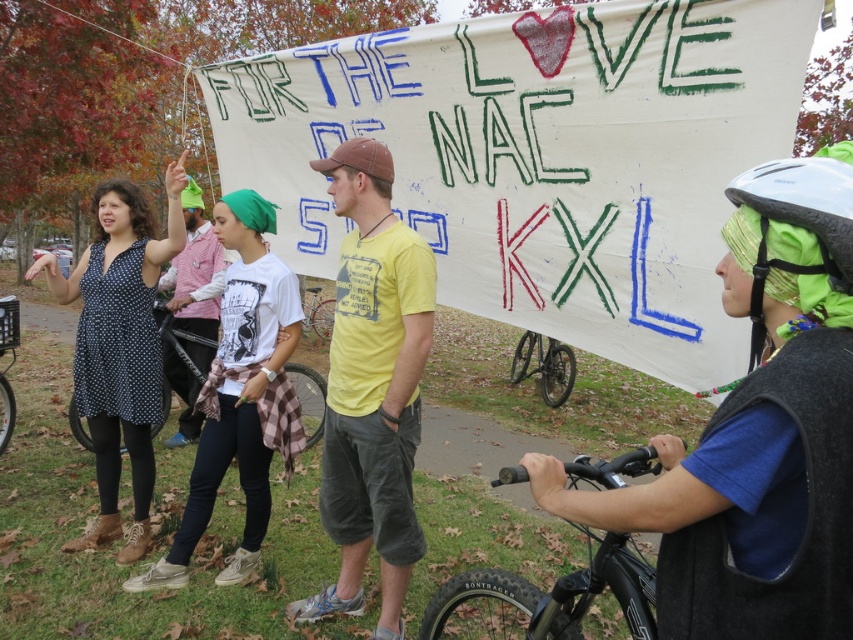
You are a pedestrian trying to cross the path where the black matte bicycle at lower center and the metallic silver bicycle at center are positioned. Which bicycle should you avoid stepping over first?

The black matte bicycle at lower center is located below metallic silver bicycle at center, so you should avoid stepping over the metallic silver bicycle at center first as it is higher up.

You are a photographer standing at the edge of the park. You want to take a photo of the large banner held by the protesters, but there is a black matte bicycle at lower center in the way. Can you estimate how far you need to move forward to get the bicycle out of the frame?

The black matte bicycle at lower center is 6.95 meters away from you. To get it out of the frame, you would need to move forward enough so that the bicycle is no longer visible. However, without knowing the camera lens and framing details, an exact distance can not be calculated.

You are a photographer trying to capture the protest scene. You notice the polka dot dress at left and the metallic silver bicycle at center. Which object is wider in the image?

The polka dot dress at left is wider than the metallic silver bicycle at center according to the description.